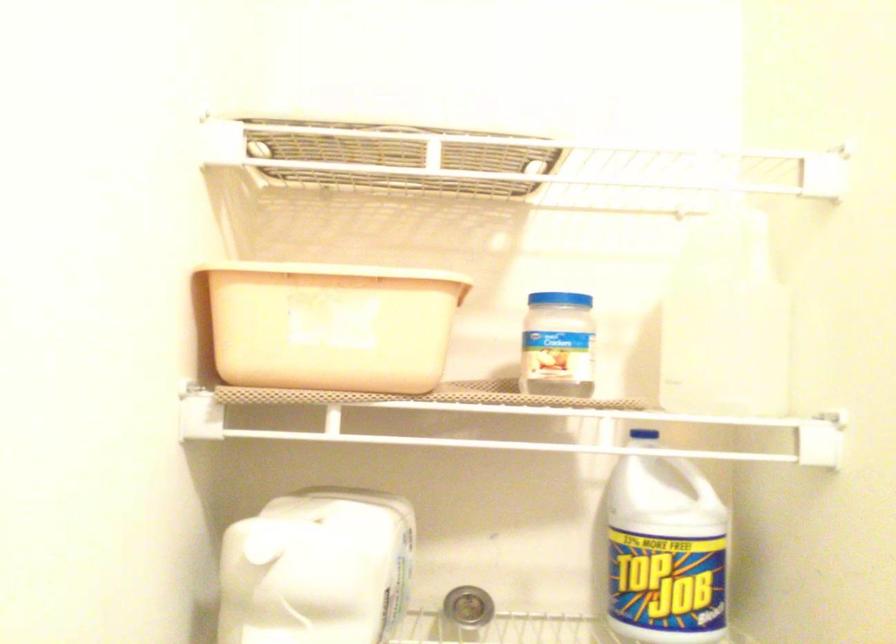
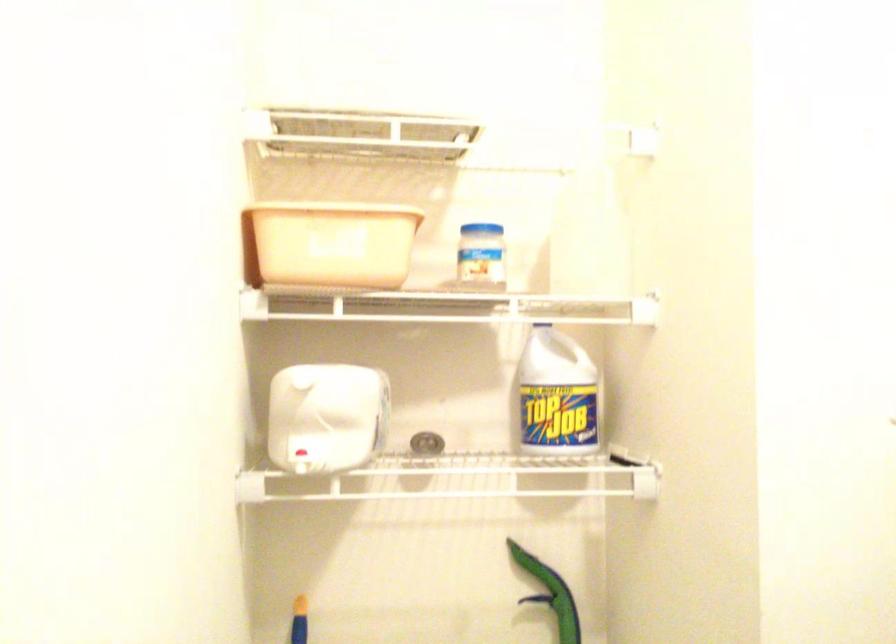
Locate, in the second image, the point that corresponds to [332,328] in the first image.

(333, 243)